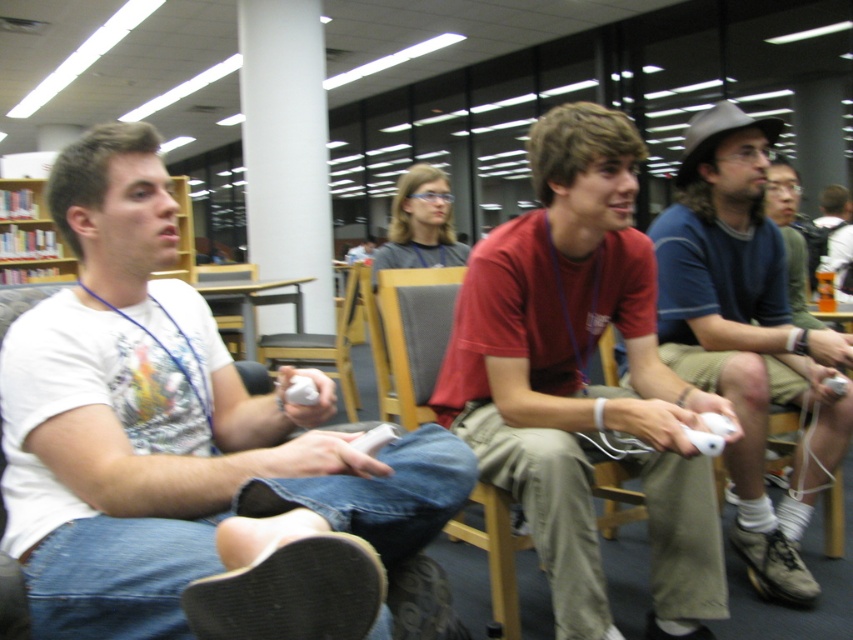
Question: Which point is closer to the camera?

Choices:
 (A) gray fabric chair at center
 (B) white matte shirt at left
 (C) matte blue shirt at center

Answer: (B)

Question: Can you confirm if white matte shirt at left is bigger than matte blue shirt at center?

Choices:
 (A) no
 (B) yes

Answer: (B)

Question: Which of the following is the closest to the observer?

Choices:
 (A) (277, 339)
 (B) (733, 320)
 (C) (396, 308)
 (D) (15, 483)

Answer: (D)

Question: Is gray fabric chair at center to the left of wooden chair at center from the viewer's perspective?

Choices:
 (A) no
 (B) yes

Answer: (A)

Question: Does gray fabric chair at center appear on the right side of wooden chair at center?

Choices:
 (A) no
 (B) yes

Answer: (B)

Question: Which point appears closest to the camera in this image?

Choices:
 (A) (814, 356)
 (B) (212, 531)
 (C) (347, 324)
 (D) (444, 349)

Answer: (B)